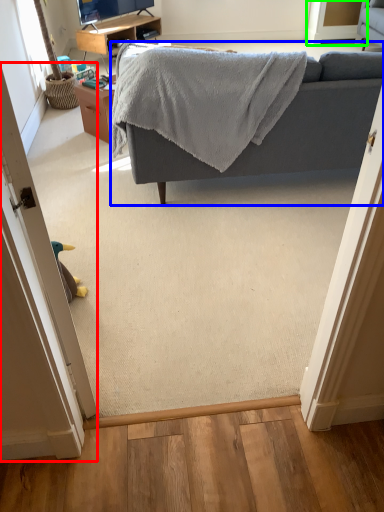
Question: Which object is positioned closest to door (highlighted by a red box)? Select from studio couch (highlighted by a blue box) and screen door (highlighted by a green box).

Choices:
 (A) studio couch
 (B) screen door

Answer: (A)